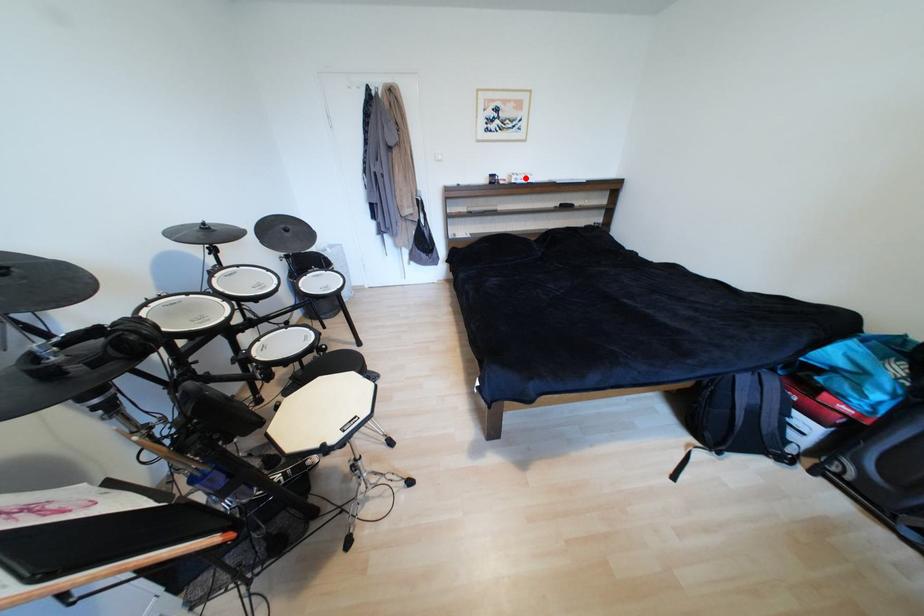
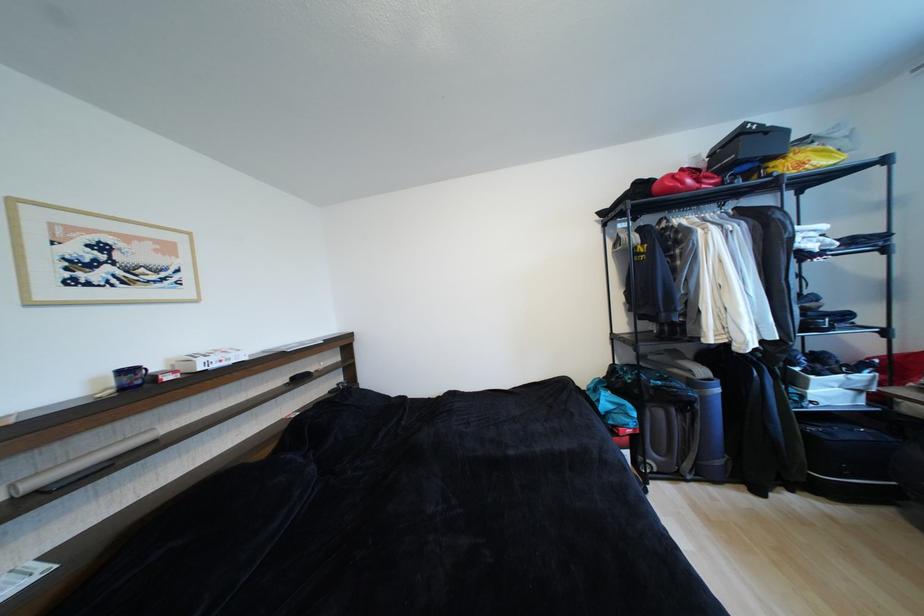
Question: A red point is marked in image1. In image2, is the corresponding 3D point closer to the camera or farther? Reply with the corresponding letter.

Choices:
 (A) The corresponding 3D point is closer.
 (B) The corresponding 3D point is farther.

Answer: (B)